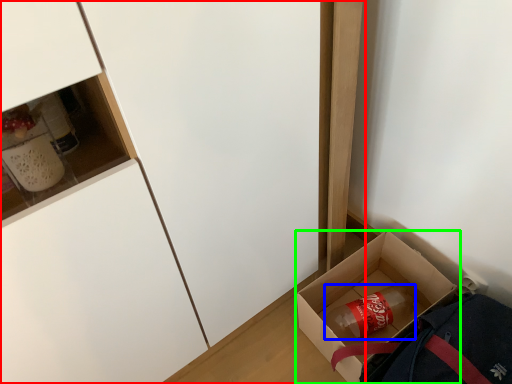
Question: Based on their relative distances, which object is nearer to cabinetry (highlighted by a red box)? Choose from beverage (highlighted by a blue box) and box (highlighted by a green box).

Choices:
 (A) beverage
 (B) box

Answer: (B)